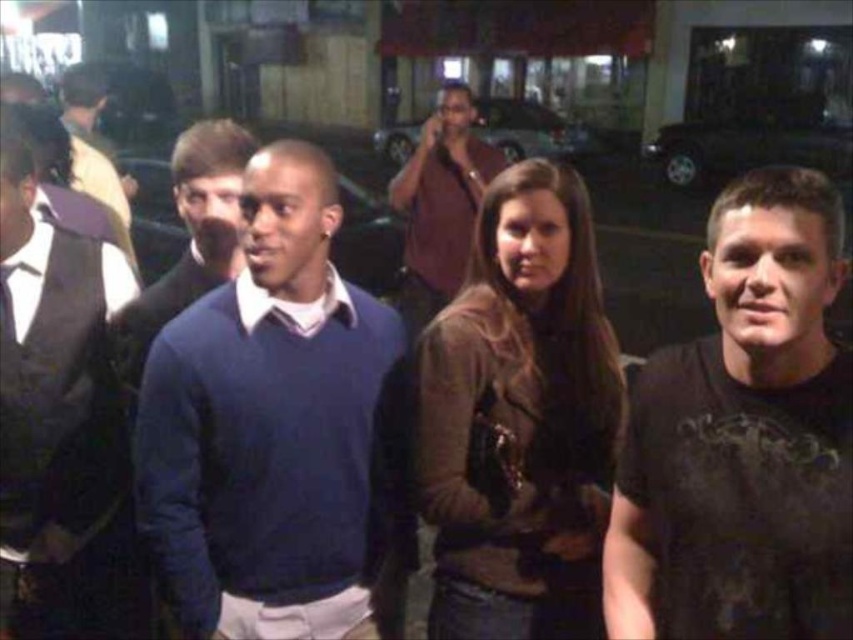
Question: Which point is farther to the camera?

Choices:
 (A) (697, 150)
 (B) (192, 572)
 (C) (514, 131)
 (D) (68, 307)

Answer: (C)

Question: Can you confirm if matte black vest at left is bigger than matte brown shirt at center?

Choices:
 (A) yes
 (B) no

Answer: (A)

Question: Does matte brown shirt at center have a smaller size compared to dark blue sweater at center?

Choices:
 (A) yes
 (B) no

Answer: (B)

Question: Is dark blue sweater at center to the left of metallic silver car at upper right from the viewer's perspective?

Choices:
 (A) no
 (B) yes

Answer: (B)

Question: Which object is farther from the camera taking this photo?

Choices:
 (A) dark blue sweater at center
 (B) metallic silver car at upper right

Answer: (B)

Question: Among these points, which one is nearest to the camera?

Choices:
 (A) (525, 116)
 (B) (142, 496)
 (C) (712, 170)

Answer: (B)